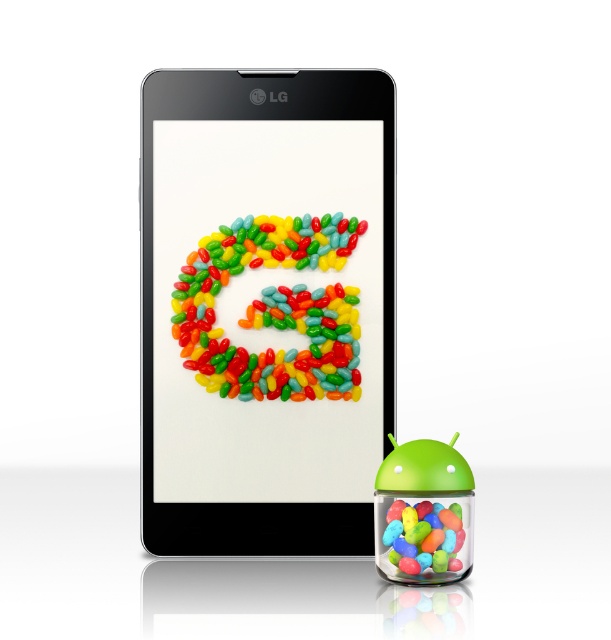
Does glossy jellybeans at center appear under glossy plastic jelly beans at lower right?

No, glossy jellybeans at center is not below glossy plastic jelly beans at lower right.

Between glossy jellybeans at center and glossy plastic jelly beans at lower right, which one appears on the right side from the viewer's perspective?

From the viewer's perspective, glossy plastic jelly beans at lower right appears more on the right side.

Between point (233, 236) and point (452, 556), which one is positioned in front?

Point (452, 556)

I want to click on glossy jellybeans at center, so click(x=273, y=308).

Who is shorter, matte plastic phone at center or glossy jellybeans at center?

glossy jellybeans at center is shorter.

Is point (376, 460) behind point (326, 353)?

That is False.

Who is more forward, (196,554) or (249,317)?

Point (196,554)

At what (x,y) coordinates should I click in order to perform the action: click on matte plastic phone at center. Please return your answer as a coordinate pair (x, y). The width and height of the screenshot is (611, 640). Looking at the image, I should click on (265, 308).

Does matte plastic phone at center have a larger size compared to glossy plastic jelly beans at lower right?

Yes.

The image size is (611, 640). What do you see at coordinates (265, 308) in the screenshot?
I see `matte plastic phone at center` at bounding box center [265, 308].

You are a GUI agent. You are given a task and a screenshot of the screen. Output one action in this format:
    pyautogui.click(x=<x>, y=<y>)
    Task: Click on the matte plastic phone at center
    
    Given the screenshot: What is the action you would take?
    pyautogui.click(x=265, y=308)